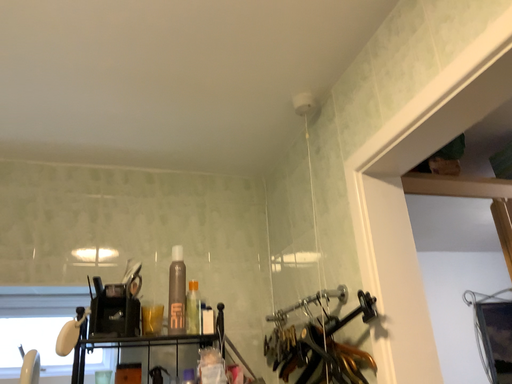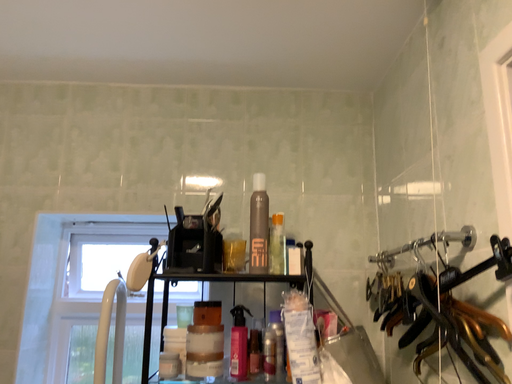
Question: Which way did the camera rotate in the video?

Choices:
 (A) rotated right
 (B) rotated left

Answer: (B)